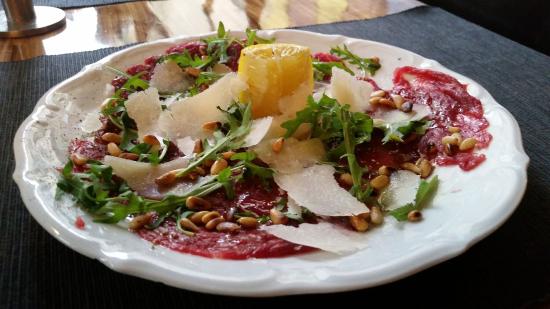
Identify the location of wooden table. (305, 18).